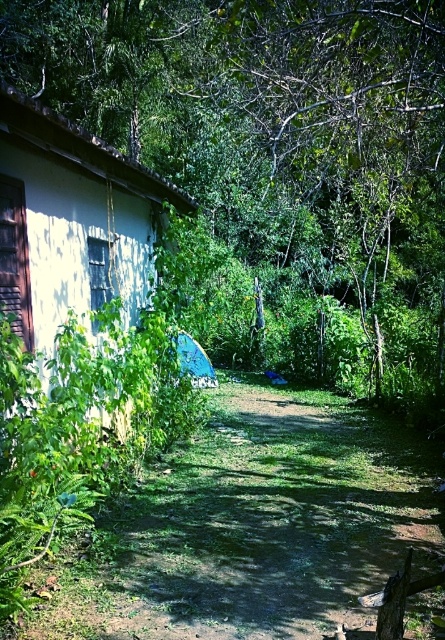
Is green leafy tree at center wider than dirt path at center?

Indeed, green leafy tree at center has a greater width compared to dirt path at center.

Does green leafy tree at center lie behind dirt path at center?

No.

You are a GUI agent. You are given a task and a screenshot of the screen. Output one action in this format:
    pyautogui.click(x=<x>, y=<y>)
    Task: Click on the green leafy tree at center
    This screenshot has height=640, width=445.
    Given the screenshot: What is the action you would take?
    pyautogui.click(x=278, y=141)

Between green leafy tree at center and white matte hut at left, which one is positioned higher?

green leafy tree at center

From the picture: Does green leafy tree at center appear on the left side of white matte hut at left?

Incorrect, green leafy tree at center is not on the left side of white matte hut at left.

Which is behind, point (275, 193) or point (23, 211)?

The point (275, 193) is behind.

You are a GUI agent. You are given a task and a screenshot of the screen. Output one action in this format:
    pyautogui.click(x=<x>, y=<y>)
    Task: Click on the green leafy tree at center
    
    Given the screenshot: What is the action you would take?
    pyautogui.click(x=278, y=141)

Describe the element at coordinates (270, 522) in the screenshot. I see `dirt path at center` at that location.

Can you confirm if dirt path at center is smaller than white matte hut at left?

Indeed, dirt path at center has a smaller size compared to white matte hut at left.

Does point (356, 512) come closer to viewer compared to point (47, 163)?

Yes.

The width and height of the screenshot is (445, 640). What are the coordinates of `dirt path at center` in the screenshot? It's located at (270, 522).